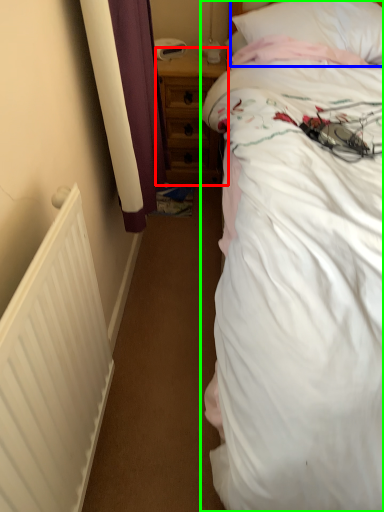
Question: Which is nearer to the nightstand (highlighted by a red box)? pillow (highlighted by a blue box) or bed (highlighted by a green box).

Choices:
 (A) pillow
 (B) bed

Answer: (A)